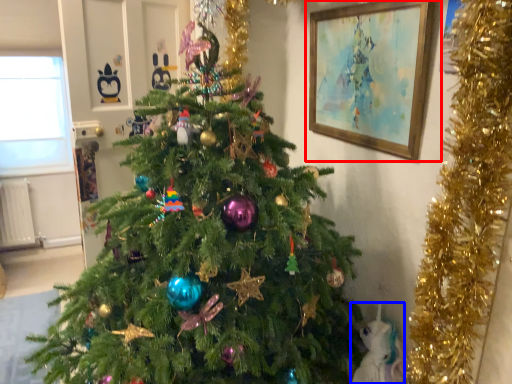
Question: Which point is further to the camera, picture frame (highlighted by a red box) or animal (highlighted by a blue box)?

Choices:
 (A) picture frame
 (B) animal

Answer: (B)